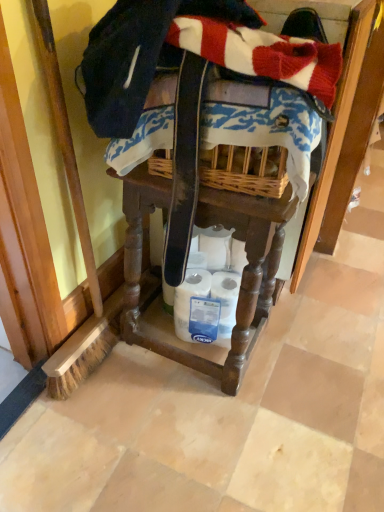
Question: From a real-world perspective, is white matte toilet paper at lower center physically below wooden vanity at center?

Choices:
 (A) no
 (B) yes

Answer: (B)

Question: Does white matte toilet paper at lower center have a lesser width compared to wooden vanity at center?

Choices:
 (A) yes
 (B) no

Answer: (A)

Question: From the image's perspective, is white matte toilet paper at lower center located above wooden vanity at center?

Choices:
 (A) yes
 (B) no

Answer: (B)

Question: Could you tell me if white matte toilet paper at lower center is turned towards wooden vanity at center?

Choices:
 (A) no
 (B) yes

Answer: (B)

Question: Are white matte toilet paper at lower center and wooden vanity at center making contact?

Choices:
 (A) no
 (B) yes

Answer: (A)

Question: Based on their positions, is wooden vanity at center located to the left or right of white matte toilet paper at lower center?

Choices:
 (A) right
 (B) left

Answer: (B)

Question: Looking at the image, does wooden vanity at center seem bigger or smaller compared to white matte toilet paper at lower center?

Choices:
 (A) small
 (B) big

Answer: (B)

Question: Do you think wooden vanity at center is within white matte toilet paper at lower center, or outside of it?

Choices:
 (A) inside
 (B) outside

Answer: (B)

Question: From the image's perspective, is wooden vanity at center located above or below white matte toilet paper at lower center?

Choices:
 (A) below
 (B) above

Answer: (B)

Question: Based on their sizes in the image, would you say white matte toilet paper at lower center is bigger or smaller than blue printed fabric at center?

Choices:
 (A) big
 (B) small

Answer: (B)

Question: Does point (213, 256) appear closer or farther from the camera than point (218, 142)?

Choices:
 (A) closer
 (B) farther

Answer: (B)

Question: Is white matte toilet paper at lower center in front of or behind blue printed fabric at center in the image?

Choices:
 (A) behind
 (B) front

Answer: (A)

Question: From the image's perspective, is white matte toilet paper at lower center located above or below blue printed fabric at center?

Choices:
 (A) below
 (B) above

Answer: (A)

Question: Would you say white matte toilet paper at lower center is inside or outside wooden vanity at center?

Choices:
 (A) outside
 (B) inside

Answer: (B)

Question: From the image's perspective, relative to wooden vanity at center, is white matte toilet paper at lower center above or below?

Choices:
 (A) below
 (B) above

Answer: (A)